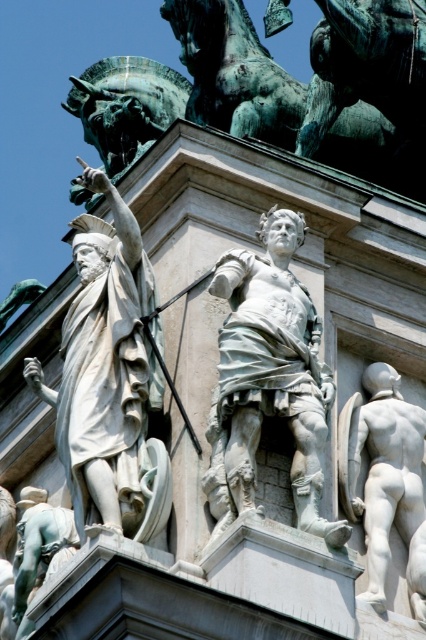
Question: Which object is positioned closest to the white marble statue at center?

Choices:
 (A) white marble statue at left
 (B) white marble nude figure at lower right

Answer: (A)

Question: Does white marble statue at left have a larger size compared to white marble statue at center?

Choices:
 (A) yes
 (B) no

Answer: (A)

Question: Which point is closer to the camera?

Choices:
 (A) (111, 292)
 (B) (250, 413)
 (C) (406, 524)

Answer: (B)

Question: Which point is farther from the camera taking this photo?

Choices:
 (A) (417, 481)
 (B) (109, 280)

Answer: (A)

Question: Is white marble statue at left bigger than white marble nude figure at lower right?

Choices:
 (A) no
 (B) yes

Answer: (B)

Question: Is the position of white marble statue at left less distant than that of white marble statue at center?

Choices:
 (A) yes
 (B) no

Answer: (A)